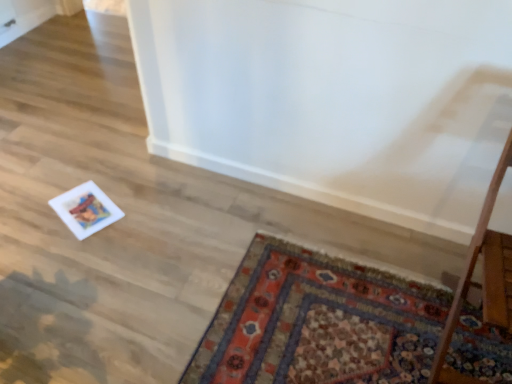
Question: Is the position of carpeted mat at lower right less distant than that of wooden table at right?

Choices:
 (A) no
 (B) yes

Answer: (A)

Question: Can you confirm if carpeted mat at lower right is wider than wooden table at right?

Choices:
 (A) no
 (B) yes

Answer: (B)

Question: Is carpeted mat at lower right shorter than wooden table at right?

Choices:
 (A) no
 (B) yes

Answer: (B)

Question: From a real-world perspective, is carpeted mat at lower right beneath wooden table at right?

Choices:
 (A) yes
 (B) no

Answer: (A)

Question: From a real-world perspective, is carpeted mat at lower right on wooden table at right?

Choices:
 (A) yes
 (B) no

Answer: (B)

Question: Considering the relative sizes of carpeted mat at lower right and wooden table at right in the image provided, is carpeted mat at lower right thinner than wooden table at right?

Choices:
 (A) yes
 (B) no

Answer: (B)

Question: From the image's perspective, is wooden table at right located beneath carpeted mat at lower right?

Choices:
 (A) yes
 (B) no

Answer: (B)

Question: Is wooden table at right positioned with its back to carpeted mat at lower right?

Choices:
 (A) no
 (B) yes

Answer: (A)

Question: Does wooden table at right have a greater height compared to carpeted mat at lower right?

Choices:
 (A) yes
 (B) no

Answer: (A)

Question: Is wooden table at right directly adjacent to carpeted mat at lower right?

Choices:
 (A) yes
 (B) no

Answer: (B)

Question: Is wooden table at right smaller than carpeted mat at lower right?

Choices:
 (A) no
 (B) yes

Answer: (A)

Question: Does wooden table at right turn towards carpeted mat at lower right?

Choices:
 (A) yes
 (B) no

Answer: (B)

Question: Looking at their shapes, would you say wooden table at right is wider or thinner than carpeted mat at lower right?

Choices:
 (A) wide
 (B) thin

Answer: (B)